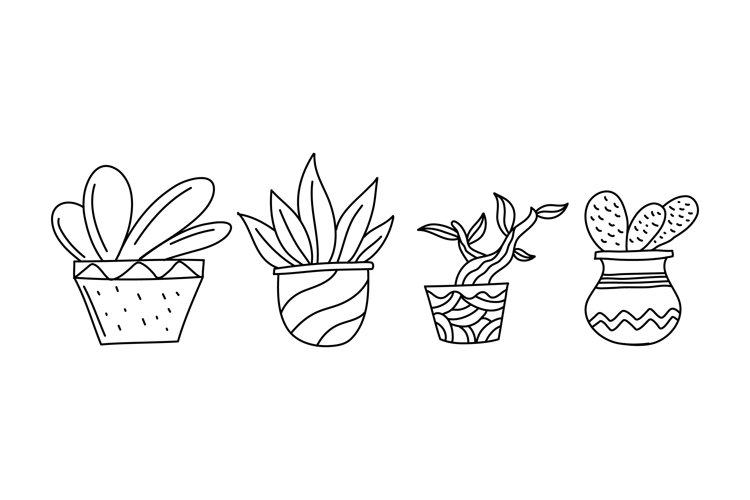
Find the location of a particular element. empty space below second vase is located at coordinates (326, 379).